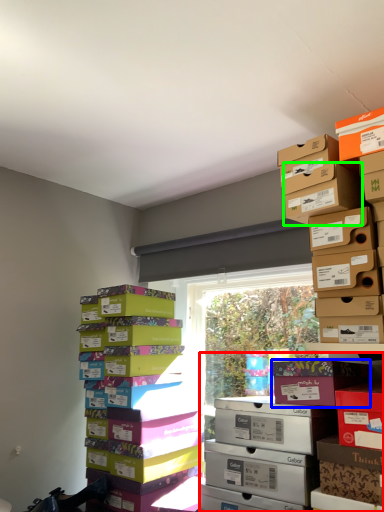
Question: Which is nearer to the shelf (highlighted by a red box)? cardboard box (highlighted by a blue box) or cardboard box (highlighted by a green box).

Choices:
 (A) cardboard box
 (B) cardboard box

Answer: (A)